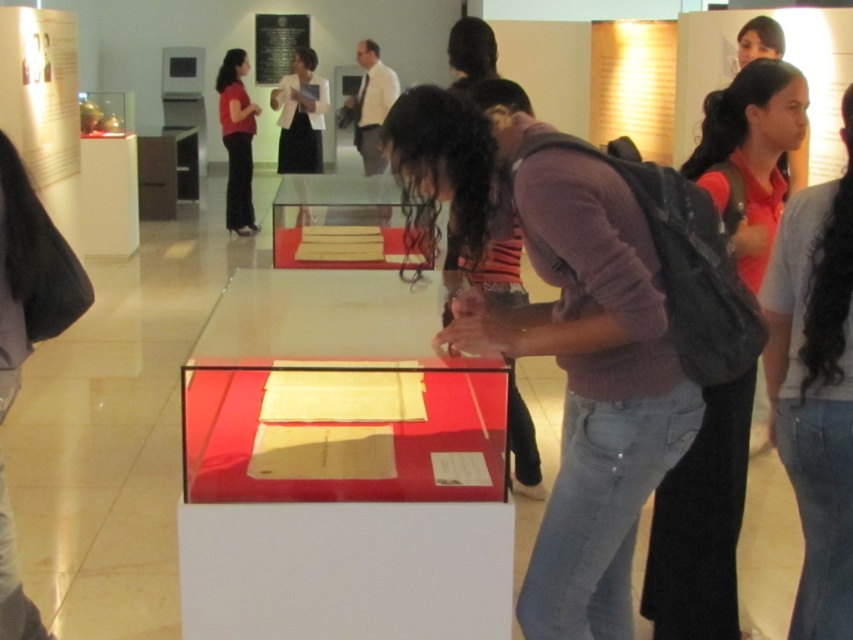
Question: Among these objects, which one is nearest to the camera?

Choices:
 (A) matte red dress at upper left
 (B) red shirt at center
 (C) matte purple sweater at center
 (D) matte gray shirt at right

Answer: (C)

Question: Which object is closer to the camera taking this photo?

Choices:
 (A) matte gray shirt at right
 (B) red shirt at center

Answer: (A)

Question: Is the position of matte purple sweater at center less distant than that of matte red dress at upper left?

Choices:
 (A) yes
 (B) no

Answer: (A)

Question: Does matte purple sweater at center appear on the right side of red shirt at center?

Choices:
 (A) yes
 (B) no

Answer: (B)

Question: Which of the following is the closest to the observer?

Choices:
 (A) (241, 86)
 (B) (436, 131)
 (C) (720, 484)
 (D) (595, 422)

Answer: (B)

Question: Is matte purple sweater at center to the left of red shirt at center from the viewer's perspective?

Choices:
 (A) no
 (B) yes

Answer: (B)